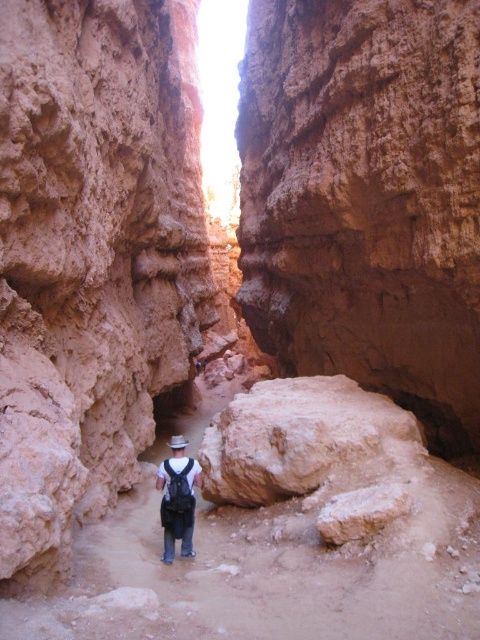
Question: Does smooth sandstone rock at center lie behind matte black backpack at center?

Choices:
 (A) no
 (B) yes

Answer: (A)

Question: Which object is closer to the camera taking this photo?

Choices:
 (A) smooth sandstone rock at center
 (B) rustic sandstone rock at center

Answer: (A)

Question: Which is farther from the rustic sandstone rock at center?

Choices:
 (A) matte black backpack at center
 (B) smooth sandstone rock at center

Answer: (A)

Question: Is smooth sandstone rock at center to the right of matte black backpack at center from the viewer's perspective?

Choices:
 (A) yes
 (B) no

Answer: (B)

Question: Is rustic sandstone rock at center wider than matte black backpack at center?

Choices:
 (A) yes
 (B) no

Answer: (A)

Question: Which of the following is the closest to the observer?

Choices:
 (A) (336, 262)
 (B) (191, 548)

Answer: (B)